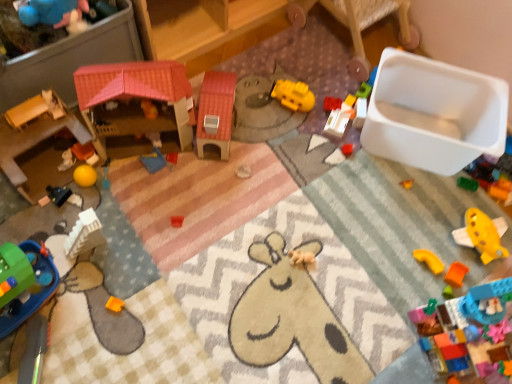
Locate an element on the screen. The height and width of the screenshot is (384, 512). free region on the left part of matte orange blocks at left, the eleventh toy viewed from the right is located at coordinates (42, 165).